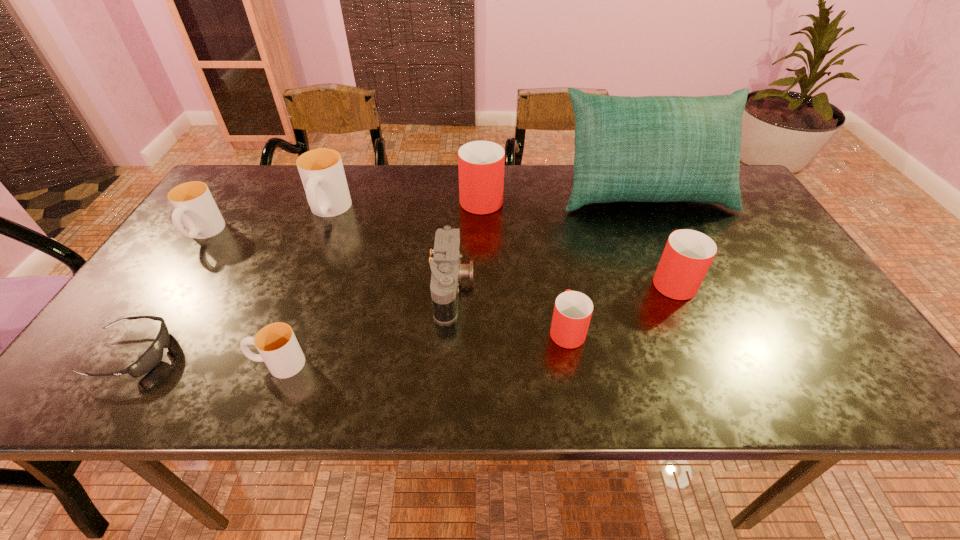
Identify the location of the tallest object. The image size is (960, 540). (651, 148).

The height and width of the screenshot is (540, 960). What are the coordinates of `the leftmost red cup` in the screenshot? It's located at 481,164.

Locate an element on the screen. the third cup from right to left is located at coordinates (481, 164).

Identify the location of the biggest yellow cup. (321, 170).

The height and width of the screenshot is (540, 960). What are the coordinates of `the rightmost red cup` in the screenshot? It's located at (688, 254).

The width and height of the screenshot is (960, 540). I want to click on the second smallest red cup, so click(x=688, y=254).

Locate an element on the screen. the second biggest yellow cup is located at coordinates (194, 205).

Find the location of a particular element. The width and height of the screenshot is (960, 540). the leftmost cup is located at coordinates (194, 205).

The image size is (960, 540). In order to click on camera in this screenshot , I will do `click(447, 271)`.

The image size is (960, 540). I want to click on the nearest red cup, so click(572, 313).